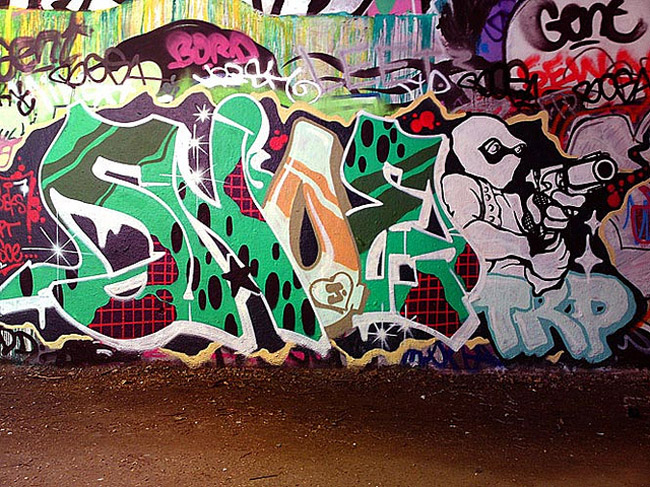
This screenshot has width=650, height=487. Identify the location of wall behind graffiti. (348, 173).